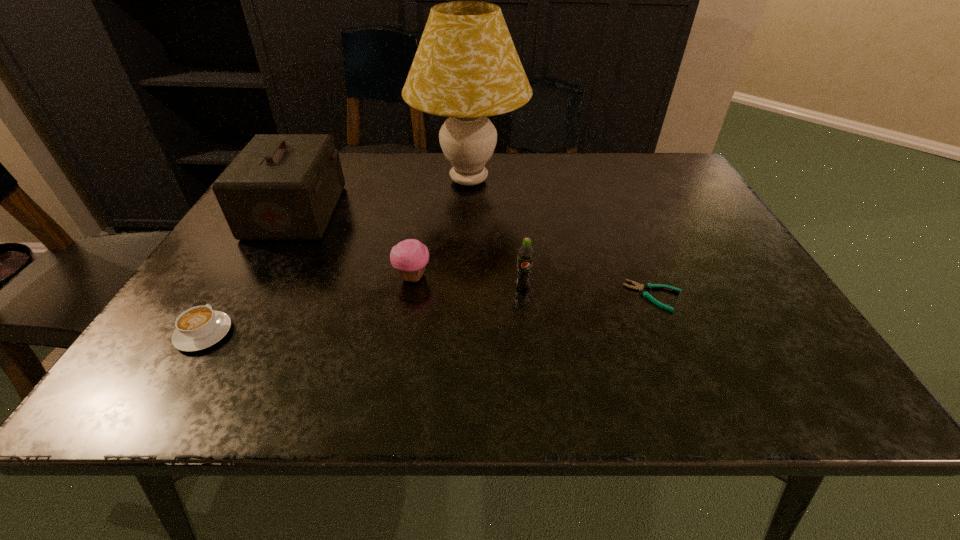
At what (x,y) coordinates should I click in order to perform the action: click on object that is at the far left corner. Please return your answer as a coordinate pair (x, y). Looking at the image, I should click on (280, 186).

At what (x,y) coordinates should I click in order to perform the action: click on vacant area at the far edge of the desktop. Please return your answer as a coordinate pair (x, y). This screenshot has height=540, width=960. Looking at the image, I should click on (365, 156).

This screenshot has height=540, width=960. What are the coordinates of `free location at the near edge of the desktop` in the screenshot? It's located at (x=642, y=386).

Locate an element on the screen. Image resolution: width=960 pixels, height=540 pixels. vacant space at the left edge of the desktop is located at coordinates (228, 268).

Identify the location of blank space at the right edge of the desktop. (699, 293).

Where is `blank space at the near left corner of the desktop`? blank space at the near left corner of the desktop is located at coordinates (138, 390).

The image size is (960, 540). I want to click on free region at the far right corner of the desktop, so click(x=657, y=186).

In order to click on empty location between the first-aid kit and the cupcake in this screenshot , I will do `click(354, 245)`.

Where is `empty space that is in between the second tallest object and the shortest object`? This screenshot has width=960, height=540. empty space that is in between the second tallest object and the shortest object is located at coordinates (475, 254).

The height and width of the screenshot is (540, 960). I want to click on free spot between the second tallest object and the cappuccino, so click(x=250, y=273).